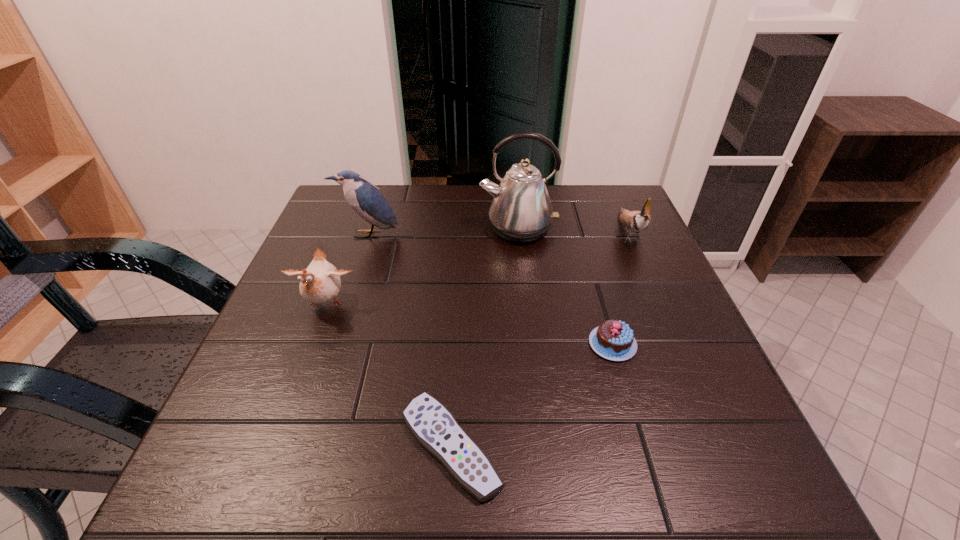
What are the coordinates of `the tallest object` in the screenshot? It's located at (521, 211).

The height and width of the screenshot is (540, 960). In order to click on the tallest bird in this screenshot , I will do `click(366, 200)`.

You are a GUI agent. You are given a task and a screenshot of the screen. Output one action in this format:
    pyautogui.click(x=<x>, y=<y>)
    Task: Click on the rightmost object
    
    Given the screenshot: What is the action you would take?
    pyautogui.click(x=636, y=221)

The image size is (960, 540). Find the location of `the nearest bird`. the nearest bird is located at coordinates (319, 283).

Find the location of a particular element. The image size is (960, 540). chocolate cake is located at coordinates coord(614,340).

Where is `the fifth farthest object`? The width and height of the screenshot is (960, 540). the fifth farthest object is located at coordinates (614, 340).

This screenshot has width=960, height=540. I want to click on the nearest object, so click(x=435, y=428).

The image size is (960, 540). What are the coordinates of `the shortest object` in the screenshot? It's located at (435, 428).

Locate an element on the screen. The width and height of the screenshot is (960, 540). free region located from the spout of the kettle is located at coordinates (535, 373).

Locate an element on the screen. free space located 0.160m at the tip of the tallest bird's beak is located at coordinates (351, 286).